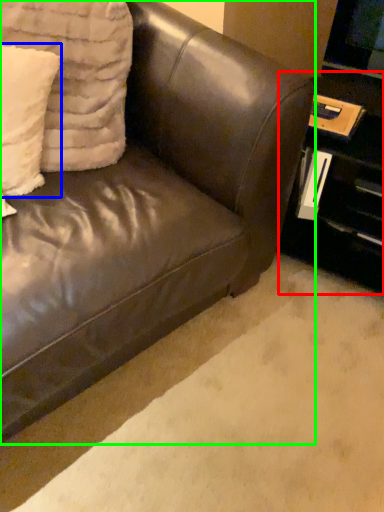
Question: Estimate the real-world distances between objects in this image. Which object is farther from table (highlighted by a red box), pillow (highlighted by a blue box) or studio couch (highlighted by a green box)?

Choices:
 (A) pillow
 (B) studio couch

Answer: (A)